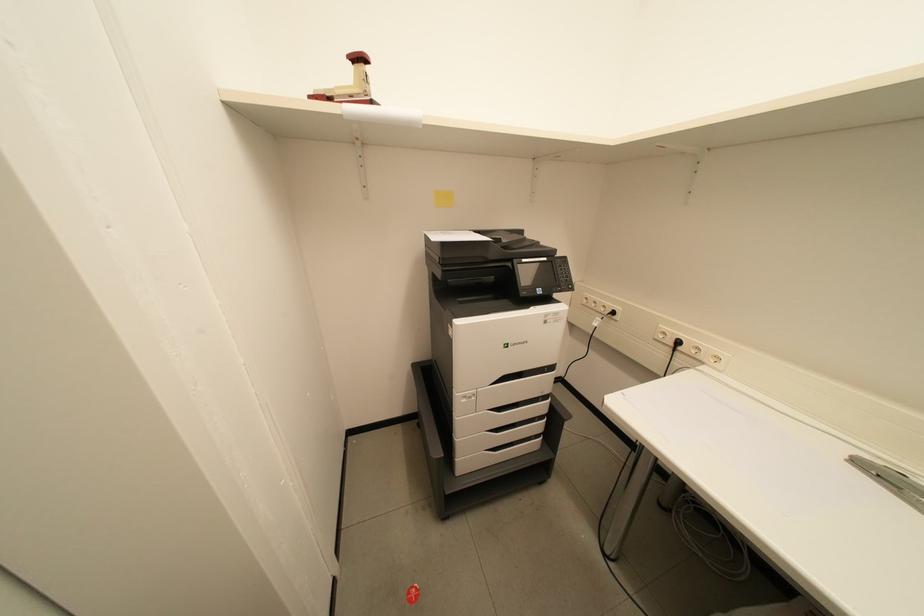
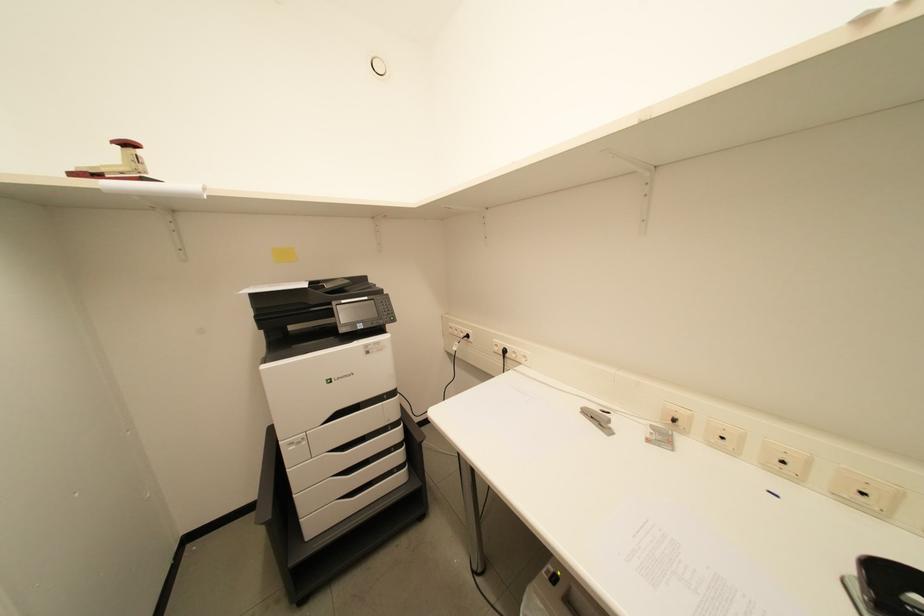
Question: The images are taken continuously from a first-person perspective. In which direction is your viewpoint rotating?

Choices:
 (A) Left
 (B) Right
 (C) Up
 (D) Down

Answer: (B)